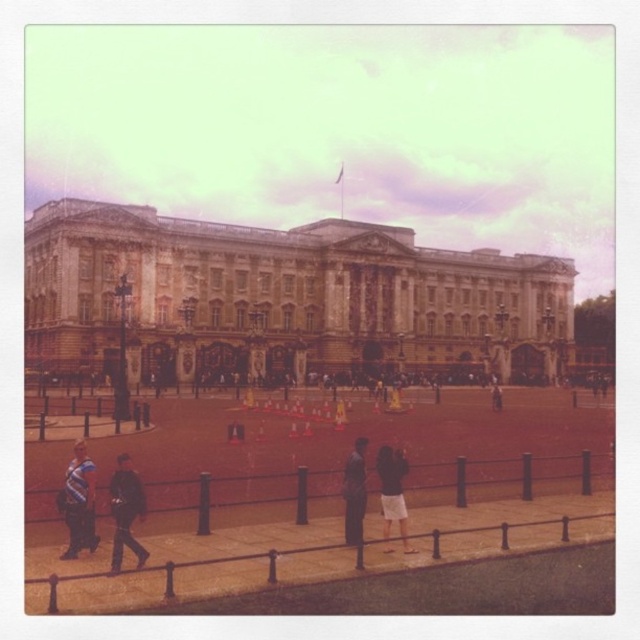
You are a tourist standing in front of the brown stone building at center and the dark brown skirt at center. Which object is larger in size?

The brown stone building at center is bigger than the dark brown skirt at center.

You are standing in front of the grand historic building and see the brown metal fence at lower center and the striped shirt at lower left. Which object is closer to the building?

The brown metal fence at lower center is closer to the building because it is positioned under the striped shirt at lower left, indicating it is in front of the shirt.